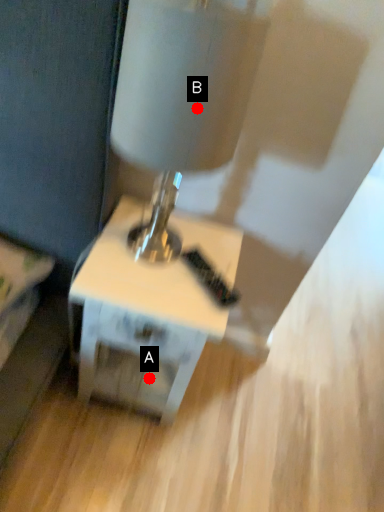
Question: Two points are circled on the image, labeled by A and B beside each circle. Which point is closer to the camera?

Choices:
 (A) A is closer
 (B) B is closer

Answer: (B)